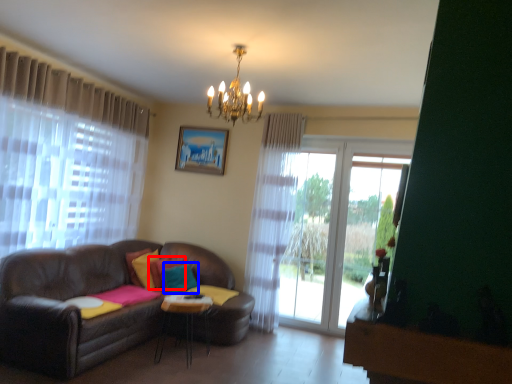
Question: Which object appears farthest to the camera in this image, pillow (highlighted by a red box) or pillow (highlighted by a blue box)?

Choices:
 (A) pillow
 (B) pillow

Answer: (A)